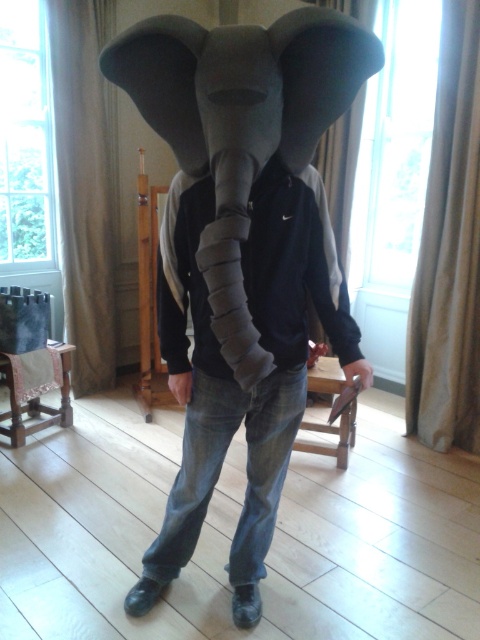
You are standing in a room with a wooden chair and a table. You see a point at coordinates (231, 371). What object is located at that point?

The object at point (231, 371) is the matte gray elephant head at center.

You are an interior designer planning to place both the matte gray elephant head at center and the felt elephant head at center on a narrow shelf. Which one should you choose to ensure it fits without exceeding the shelf width?

The felt elephant head at center has a smaller width compared to the matte gray elephant head at center, so it would fit better on the narrow shelf.